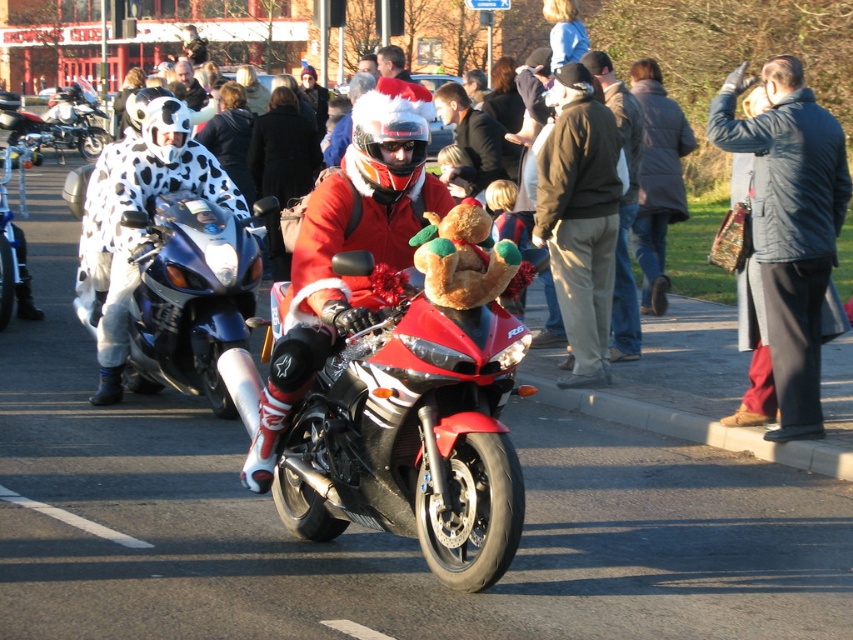
Question: Which of the following is the closest to the observer?

Choices:
 (A) shiny blue motorcycle at left
 (B) metallic blue motorcycle at left
 (C) dark blue quilted jacket at upper right
 (D) khaki pants at center

Answer: (C)

Question: Can you confirm if matte red motorcycle at center is thinner than khaki pants at center?

Choices:
 (A) yes
 (B) no

Answer: (B)

Question: Can you confirm if dark gray jacket at center is thinner than metallic blue motorcycle at left?

Choices:
 (A) no
 (B) yes

Answer: (A)

Question: Based on their relative distances, which object is nearer to the metallic blue motorcycle at left?

Choices:
 (A) dark gray jacket at center
 (B) dark blue quilted jacket at upper right
 (C) khaki pants at center
 (D) shiny red motorcycle at center

Answer: (A)

Question: Considering the real-world distances, which object is farthest from the shiny red motorcycle at center?

Choices:
 (A) shiny blue motorcycle at left
 (B) santa hat at center
 (C) khaki pants at center

Answer: (B)

Question: Does matte red motorcycle at center have a greater width compared to metallic blue motorcycle at left?

Choices:
 (A) no
 (B) yes

Answer: (B)